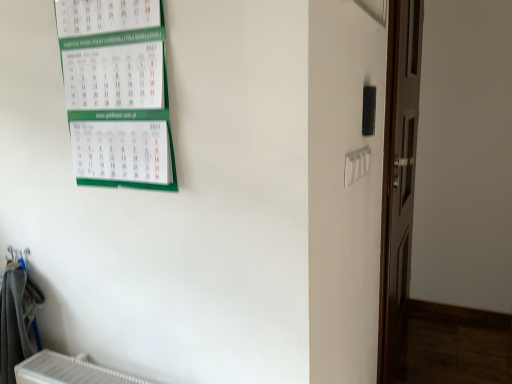
Question: Is the position of gray fabric laundry at lower left less distant than that of brown wooden door at right?

Choices:
 (A) yes
 (B) no

Answer: (A)

Question: Does gray fabric laundry at lower left have a lesser width compared to brown wooden door at right?

Choices:
 (A) yes
 (B) no

Answer: (B)

Question: Considering the relative positions of gray fabric laundry at lower left and brown wooden door at right in the image provided, is gray fabric laundry at lower left to the left of brown wooden door at right from the viewer's perspective?

Choices:
 (A) yes
 (B) no

Answer: (A)

Question: Considering the relative sizes of gray fabric laundry at lower left and brown wooden door at right in the image provided, is gray fabric laundry at lower left smaller than brown wooden door at right?

Choices:
 (A) no
 (B) yes

Answer: (B)

Question: Considering the relative sizes of gray fabric laundry at lower left and brown wooden door at right in the image provided, is gray fabric laundry at lower left shorter than brown wooden door at right?

Choices:
 (A) no
 (B) yes

Answer: (B)

Question: Can you confirm if gray fabric laundry at lower left is taller than brown wooden door at right?

Choices:
 (A) yes
 (B) no

Answer: (B)

Question: Is green paper calendar at upper left oriented towards gray fabric laundry at lower left?

Choices:
 (A) yes
 (B) no

Answer: (B)

Question: From a real-world perspective, is green paper calendar at upper left on gray fabric laundry at lower left?

Choices:
 (A) no
 (B) yes

Answer: (B)

Question: Considering the relative sizes of green paper calendar at upper left and gray fabric laundry at lower left in the image provided, is green paper calendar at upper left shorter than gray fabric laundry at lower left?

Choices:
 (A) no
 (B) yes

Answer: (B)

Question: Is green paper calendar at upper left smaller than gray fabric laundry at lower left?

Choices:
 (A) yes
 (B) no

Answer: (A)

Question: Is green paper calendar at upper left closer to the viewer compared to gray fabric laundry at lower left?

Choices:
 (A) no
 (B) yes

Answer: (B)

Question: Considering the relative sizes of green paper calendar at upper left and gray fabric laundry at lower left in the image provided, is green paper calendar at upper left wider than gray fabric laundry at lower left?

Choices:
 (A) yes
 (B) no

Answer: (B)

Question: Is green paper calendar at upper left at the right side of brown wooden door at right?

Choices:
 (A) no
 (B) yes

Answer: (A)